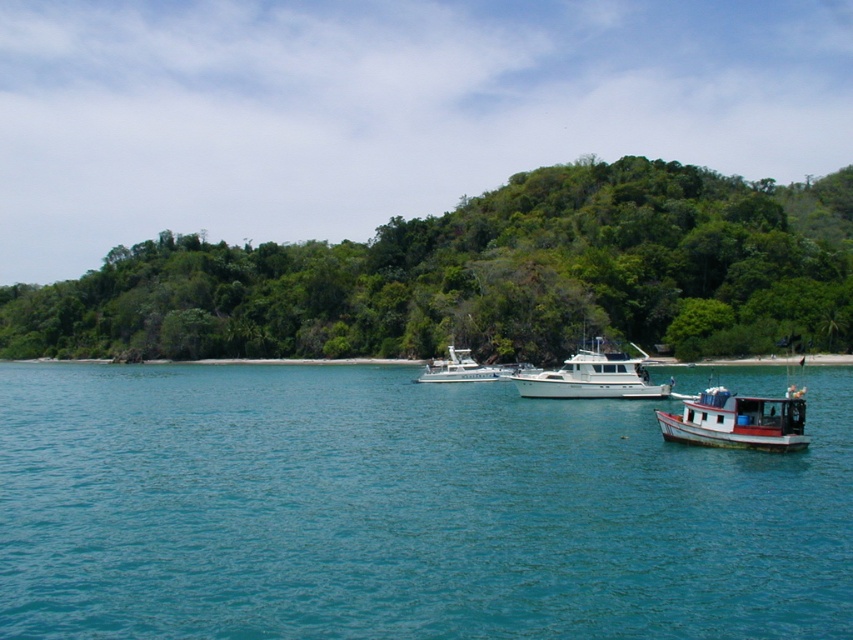
Question: Which point appears farthest from the camera in this image?

Choices:
 (A) (845, 595)
 (B) (601, 330)

Answer: (B)

Question: Considering the relative positions of white matte boat at lower right and white glossy yacht at center in the image provided, where is white matte boat at lower right located with respect to white glossy yacht at center?

Choices:
 (A) left
 (B) right

Answer: (B)

Question: Which is nearer to the white glossy boat at center?

Choices:
 (A) green leafy trees at center
 (B) clear blue water at center
 (C) white matte boat at lower right

Answer: (B)

Question: Observing the image, what is the correct spatial positioning of white glossy boat at center in reference to white glossy yacht at center?

Choices:
 (A) above
 (B) below

Answer: (A)

Question: Among these points, which one is farthest from the camera?

Choices:
 (A) (767, 429)
 (B) (579, 387)
 (C) (444, 220)

Answer: (C)

Question: Does green leafy trees at center appear on the right side of white glossy yacht at center?

Choices:
 (A) no
 (B) yes

Answer: (A)